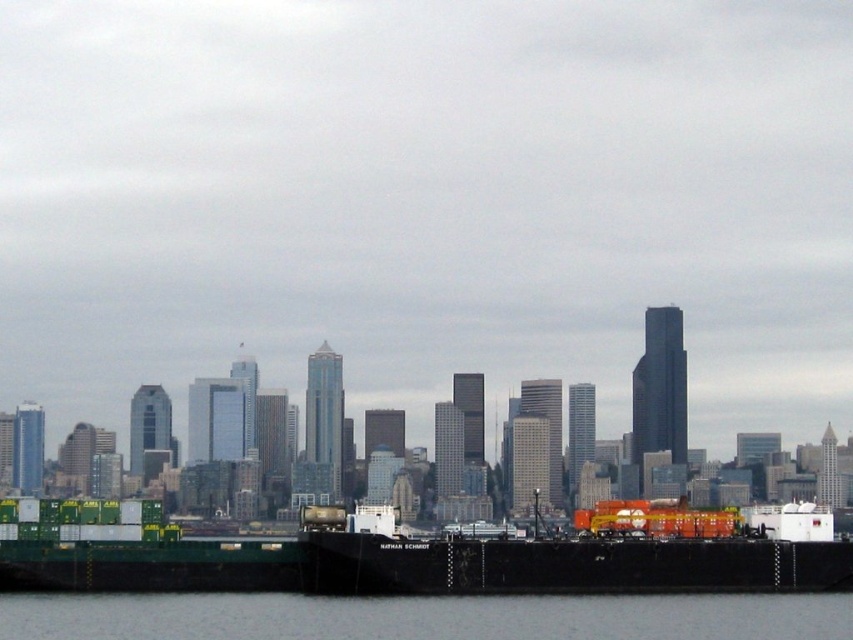
Does black matte barge at lower center appear on the right side of gray water at lower center?

Yes, black matte barge at lower center is to the right of gray water at lower center.

Is black matte barge at lower center above gray water at lower center?

Indeed, black matte barge at lower center is positioned over gray water at lower center.

Between point (686, 512) and point (647, 628), which one is positioned in front?

Point (647, 628)

Where is `black matte barge at lower center`? This screenshot has height=640, width=853. black matte barge at lower center is located at coordinates (567, 556).